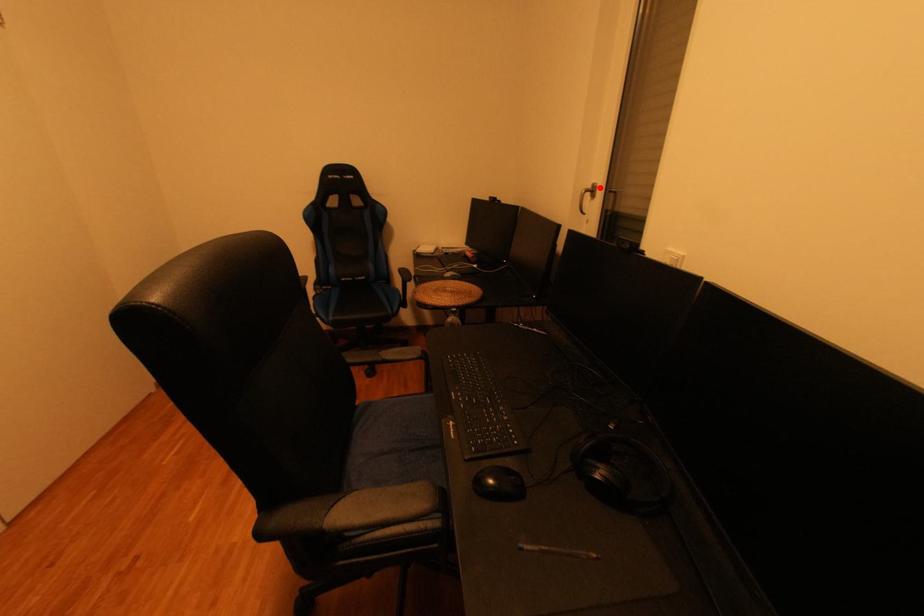
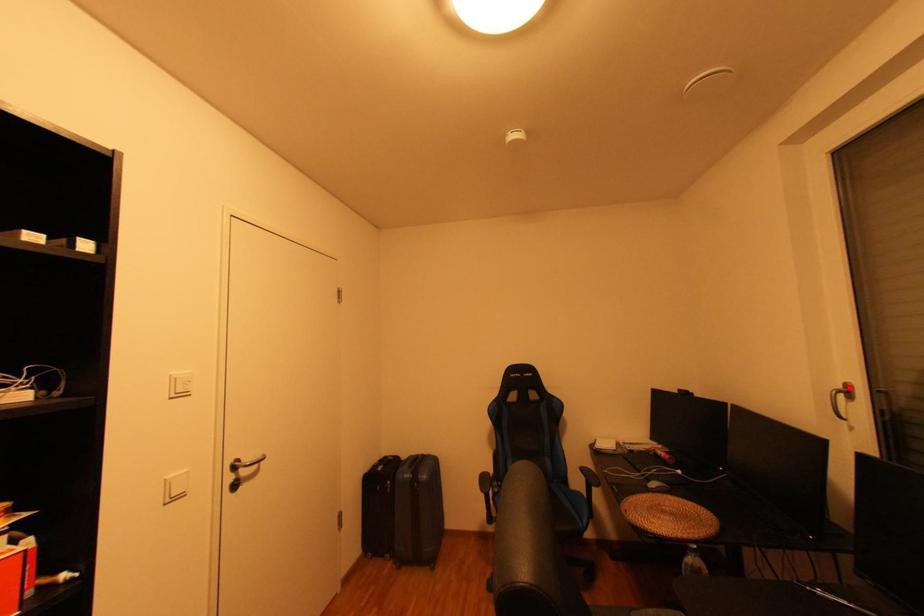
I am providing you with two images of the same scene from different viewpoints. A red point is marked on the first image and another point is marked on the second image. Are the points marked in image1 and image2 representing the same 3D position?

Yes